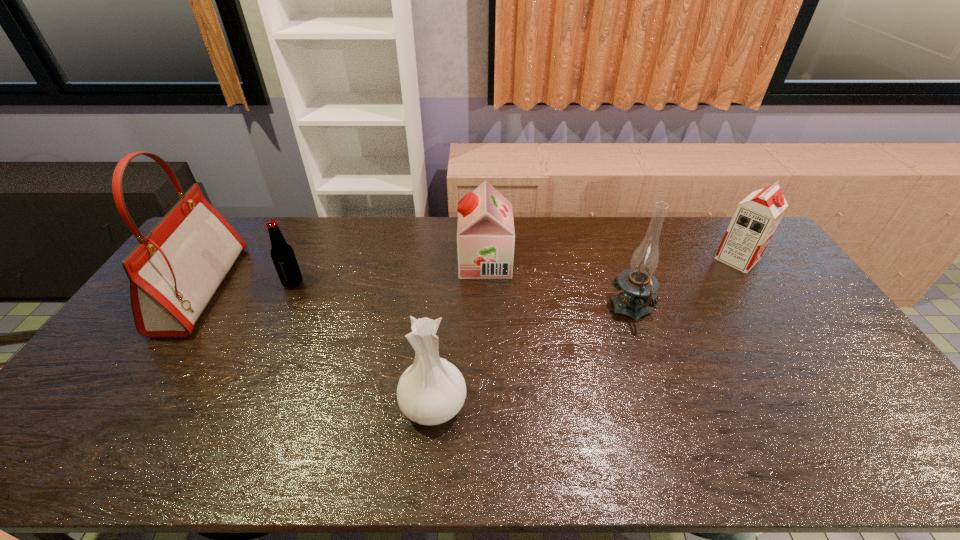
At what (x,y) coordinates should I click in order to perform the action: click on free space located on the right of the oil lamp. Please return your answer as a coordinate pair (x, y). Image resolution: width=960 pixels, height=540 pixels. Looking at the image, I should click on (684, 309).

Find the location of `vacant space located on the front of the rightmost object`. vacant space located on the front of the rightmost object is located at coordinates (810, 367).

Find the location of a particular element. The width and height of the screenshot is (960, 540). free space located with the cap open on the left soya milk is located at coordinates (372, 261).

Image resolution: width=960 pixels, height=540 pixels. Find the location of `free point located 0.180m with the cap open on the left soya milk`. free point located 0.180m with the cap open on the left soya milk is located at coordinates (408, 261).

The image size is (960, 540). I want to click on free space located 0.360m with the cap open on the left soya milk, so click(355, 261).

Where is `free space located 0.350m on the back of the nearest object`? free space located 0.350m on the back of the nearest object is located at coordinates (444, 286).

Identify the location of vacant region located on the right of the second object from left to right. (328, 283).

Image resolution: width=960 pixels, height=540 pixels. What are the coordinates of `handbag that is at the far edge` in the screenshot? It's located at (174, 272).

Find the location of a particular element. This screenshot has height=540, width=960. object that is at the near edge is located at coordinates (431, 391).

Identify the location of object located at the left edge. (174, 272).